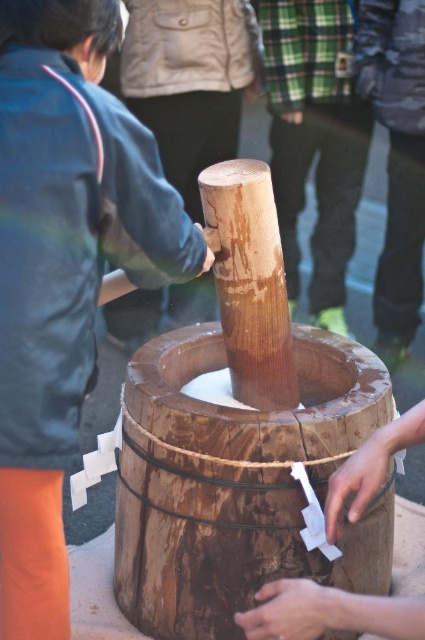
Question: Is dark blue jacket at left bigger than wooden hand at center?

Choices:
 (A) yes
 (B) no

Answer: (A)

Question: Which object appears closest to the camera in this image?

Choices:
 (A) wooden barrel at center
 (B) dark blue jacket at left
 (C) wooden hand at center

Answer: (C)

Question: Is dark blue jacket at left in front of wooden barrel at center?

Choices:
 (A) no
 (B) yes

Answer: (B)

Question: Which object is farther from the camera taking this photo?

Choices:
 (A) dark blue jacket at left
 (B) wooden hand at center
 (C) wooden barrel at center

Answer: (C)

Question: Which point appears farthest from the camera in this image?

Choices:
 (A) (391, 426)
 (B) (223, 362)

Answer: (B)

Question: Does dark blue jacket at left have a lesser width compared to wooden hand at center?

Choices:
 (A) yes
 (B) no

Answer: (B)